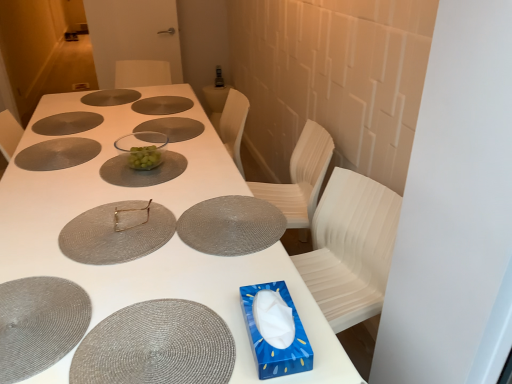
Where is `vacant space that's between matte gray glass plate at upper left, the fifth glass plate when ordered from front to back, and matte silver fork at center`? The width and height of the screenshot is (512, 384). vacant space that's between matte gray glass plate at upper left, the fifth glass plate when ordered from front to back, and matte silver fork at center is located at coordinates (80, 175).